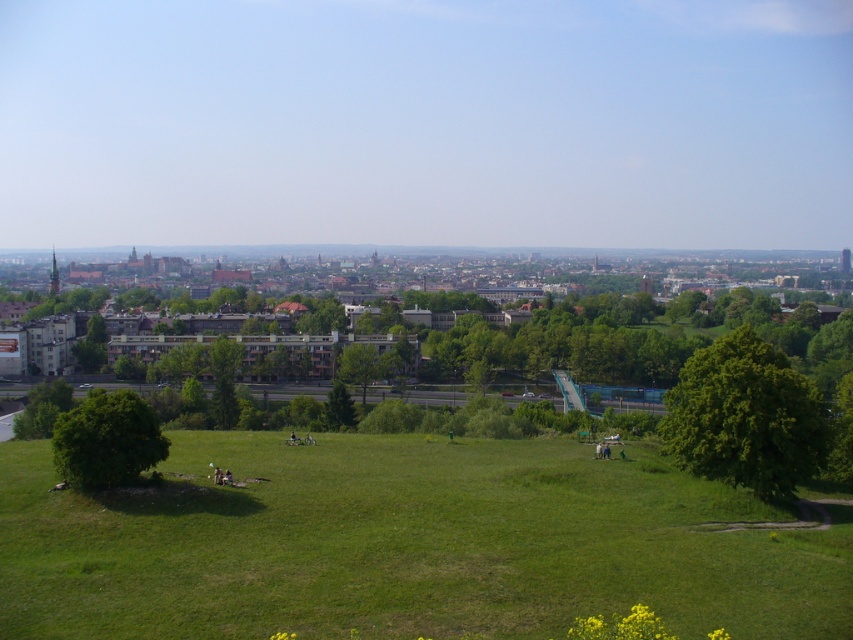
You are standing at the highest point of the city and looking down at the scene. You notice a point marked at coordinates (746, 417). What object does this point correspond to in the image?

The point at coordinates (746, 417) corresponds to the green leafy tree at center right.

Based on the photo, you are standing at the point with coordinates (746, 417) in the cityscape image. What object are you at?

The point at coordinates (746, 417) corresponds to the green leafy tree at center right.